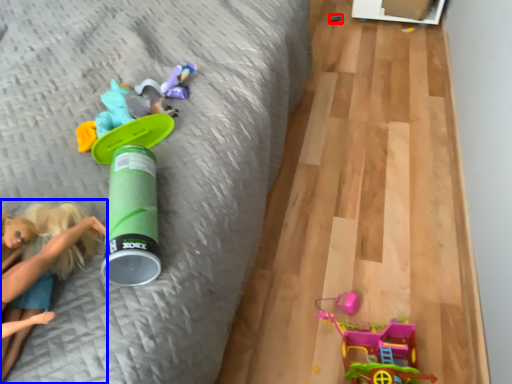
Question: Which object is further to the camera taking this photo, toy (highlighted by a red box) or person (highlighted by a blue box)?

Choices:
 (A) toy
 (B) person

Answer: (A)